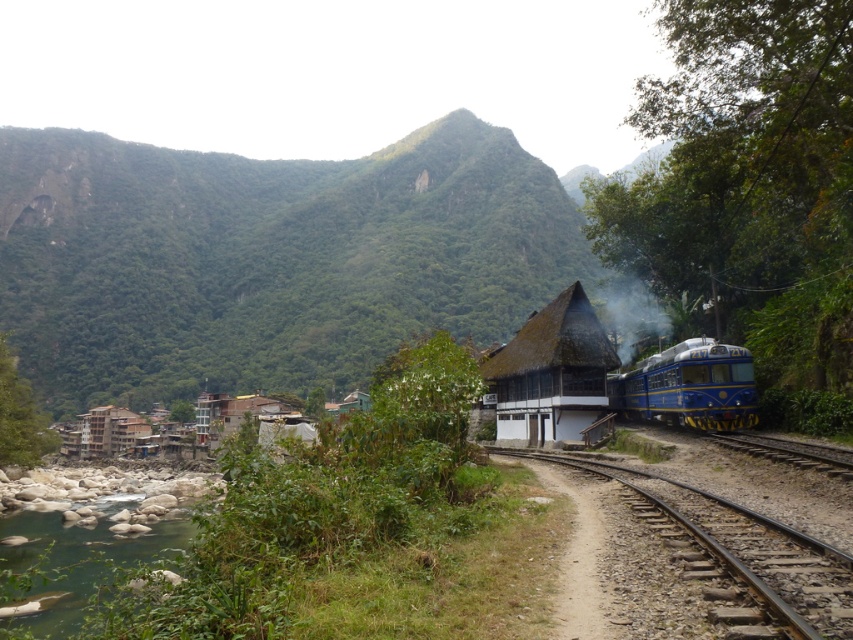
Is green leafy mountain at upper left to the left of brown gravel track at lower right from the viewer's perspective?

Indeed, green leafy mountain at upper left is positioned on the left side of brown gravel track at lower right.

Is point (262, 232) less distant than point (846, 586)?

No.

Locate an element on the screen. Image resolution: width=853 pixels, height=640 pixels. green leafy mountain at upper left is located at coordinates (267, 259).

Which is in front, point (849, 632) or point (83, 432)?

Positioned in front is point (849, 632).

Can you confirm if brown gravel track at lower right is taller than brown corrugated metal hut at lower left?

Incorrect, brown gravel track at lower right's height is not larger of brown corrugated metal hut at lower left's.

Where is `brown gravel track at lower right`? brown gravel track at lower right is located at coordinates (704, 564).

The image size is (853, 640). Identify the location of brown gravel track at lower right. (704, 564).

Which of these two, brown gravel track at lower right or white smoke at center, stands taller?

white smoke at center

Between brown gravel track at lower right and white smoke at center, which one is positioned lower?

Positioned lower is brown gravel track at lower right.

At what (x,y) coordinates should I click in order to perform the action: click on brown gravel track at lower right. Please return your answer as a coordinate pair (x, y). Looking at the image, I should click on (704, 564).

Locate an element on the screen. The image size is (853, 640). brown gravel track at lower right is located at coordinates (704, 564).